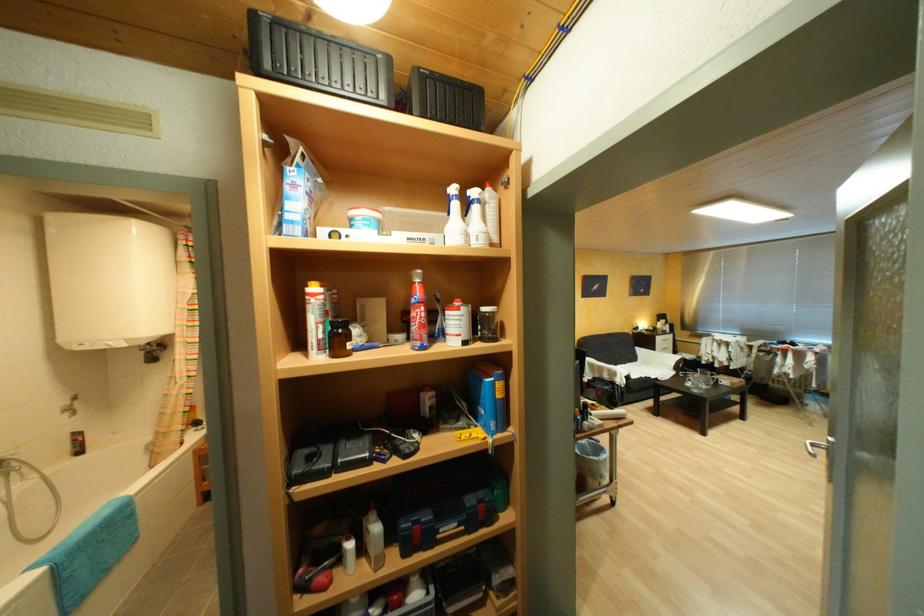
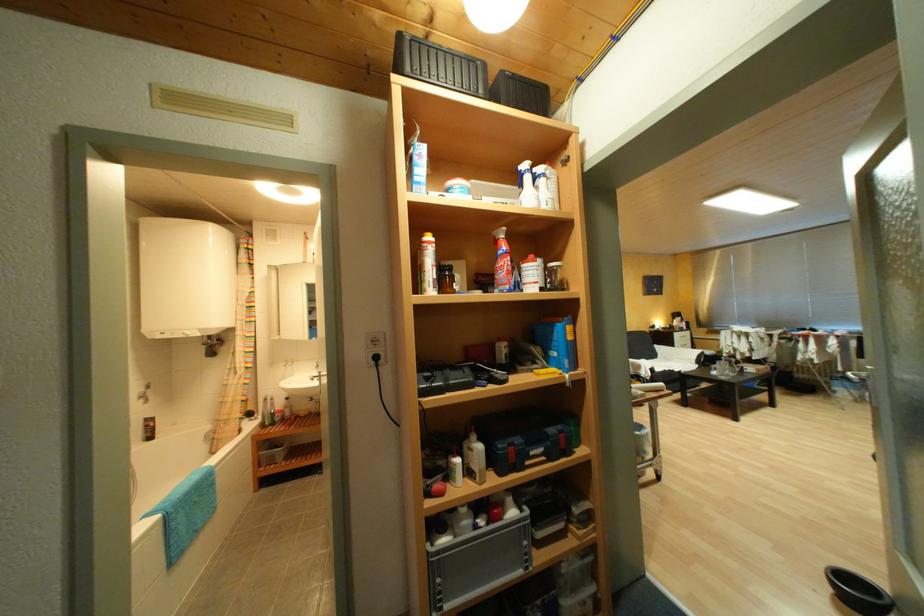
Locate, in the second image, the point that corresponds to (x=794, y=216) in the first image.

(798, 206)